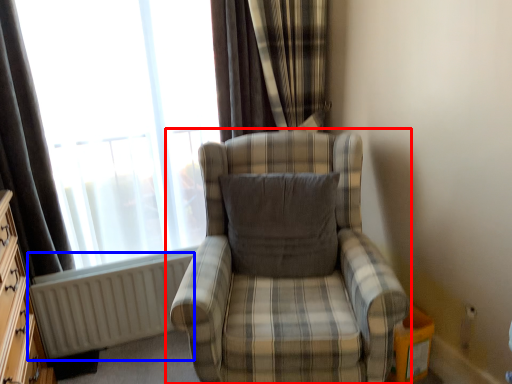
Question: Which of the following is the farthest to the observer, chair (highlighted by a red box) or radiator (highlighted by a blue box)?

Choices:
 (A) chair
 (B) radiator

Answer: (B)